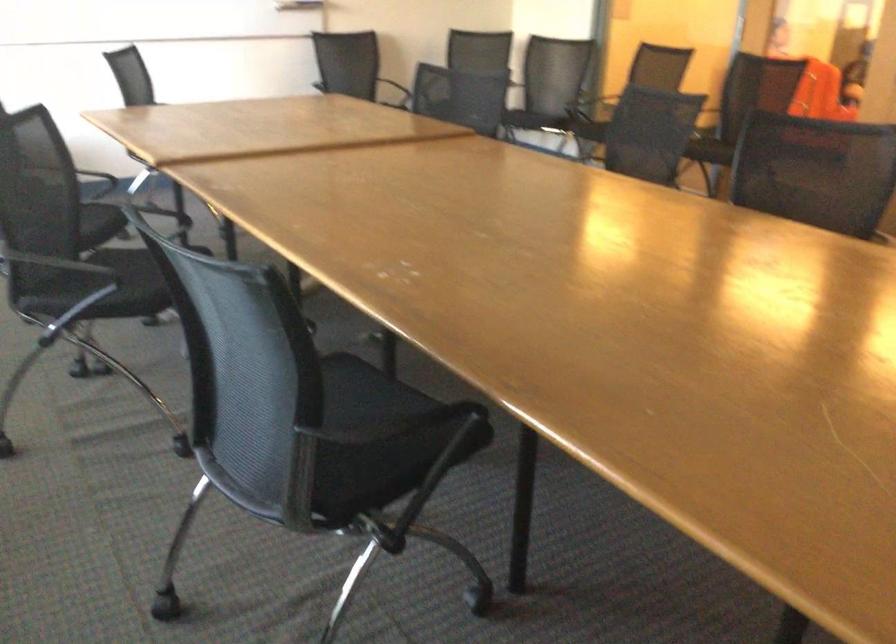
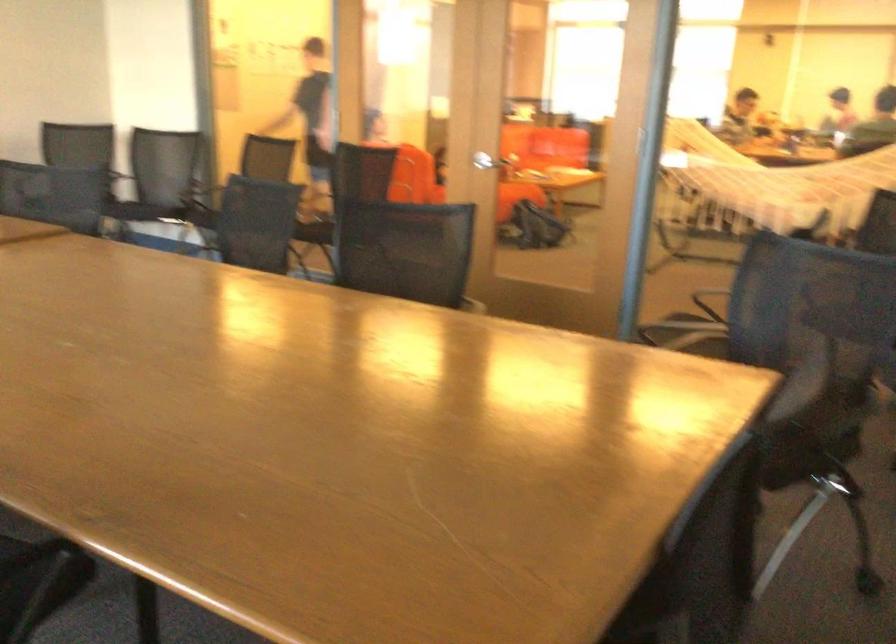
Where in the second image is the point corresponding to (571,122) from the first image?

(202, 216)